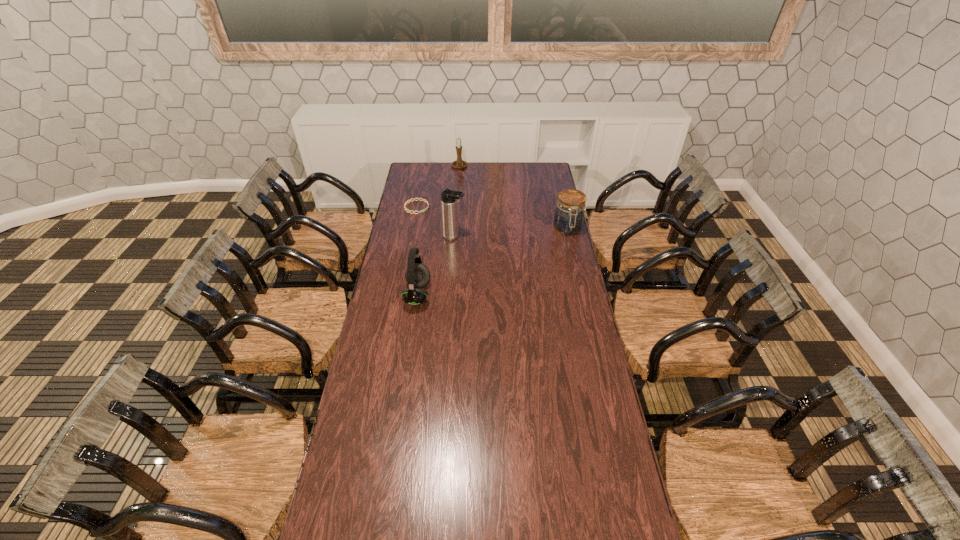
Locate an element on the screen. Image resolution: width=960 pixels, height=540 pixels. object positioned at the right edge is located at coordinates (568, 219).

In the image, there is a desktop. At what (x,y) coordinates should I click in order to perform the action: click on vacant region at the far edge. Please return your answer as a coordinate pair (x, y). Looking at the image, I should click on (440, 171).

Where is `free space at the near edge`? This screenshot has height=540, width=960. free space at the near edge is located at coordinates (559, 508).

I want to click on blank space at the right edge of the desktop, so click(548, 207).

The image size is (960, 540). In the image, there is a desktop. Find the location of `vacant space at the near left corner`. vacant space at the near left corner is located at coordinates (340, 513).

The height and width of the screenshot is (540, 960). Identify the location of free region at the far right corner of the desktop. (531, 164).

Where is `free space between the headset and the tallest object`? Image resolution: width=960 pixels, height=540 pixels. free space between the headset and the tallest object is located at coordinates (436, 266).

Image resolution: width=960 pixels, height=540 pixels. I want to click on free space between the rightmost object and the thermos bottle, so pos(511,233).

This screenshot has height=540, width=960. I want to click on free spot between the tallest object and the jar, so click(511, 233).

What are the coordinates of `vacant area that lies between the candle holder and the bracelet` in the screenshot? It's located at (438, 187).